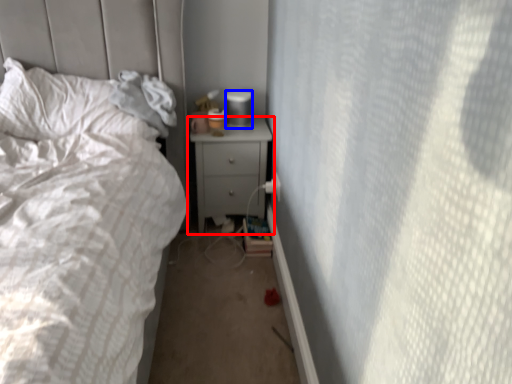
Question: Which of the following is the farthest to the observer, nightstand (highlighted by a red box) or gray (highlighted by a blue box)?

Choices:
 (A) nightstand
 (B) gray

Answer: (B)